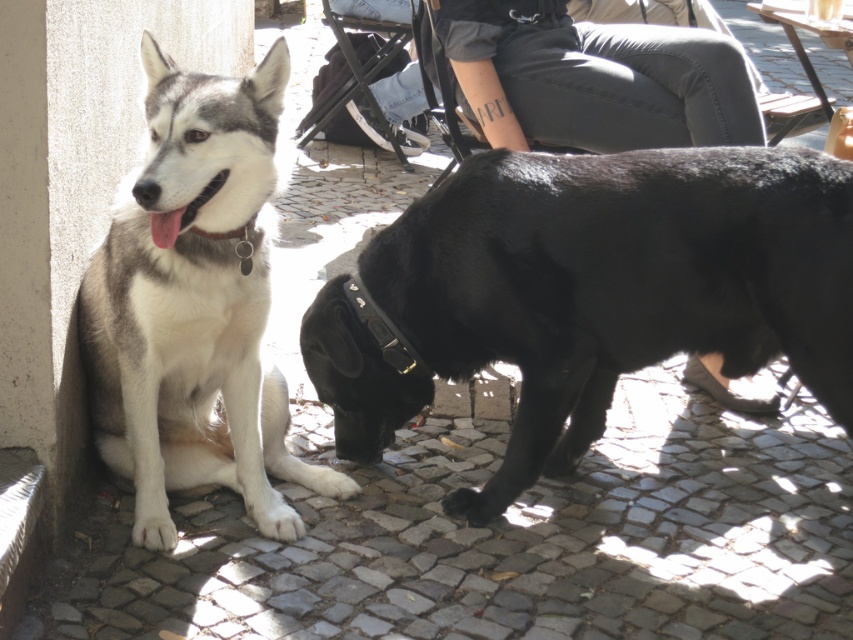
Question: Which of the following is the farthest from the observer?

Choices:
 (A) gray denim pants at center
 (B) black smooth dog at lower right

Answer: (A)

Question: Does black smooth dog at lower right lie behind gray-white fur dog at left?

Choices:
 (A) yes
 (B) no

Answer: (A)

Question: Does black smooth dog at lower right lie in front of gray denim pants at center?

Choices:
 (A) yes
 (B) no

Answer: (A)

Question: Which point appears farthest from the camera in this image?

Choices:
 (A) (642, 128)
 (B) (192, 131)
 (C) (486, 486)

Answer: (A)

Question: Which of these objects is positioned farthest from the black smooth dog at lower right?

Choices:
 (A) gray-white fur dog at left
 (B) gray denim pants at center

Answer: (B)

Question: Where is black smooth dog at lower right located in relation to gray-white fur dog at left in the image?

Choices:
 (A) below
 (B) above

Answer: (A)